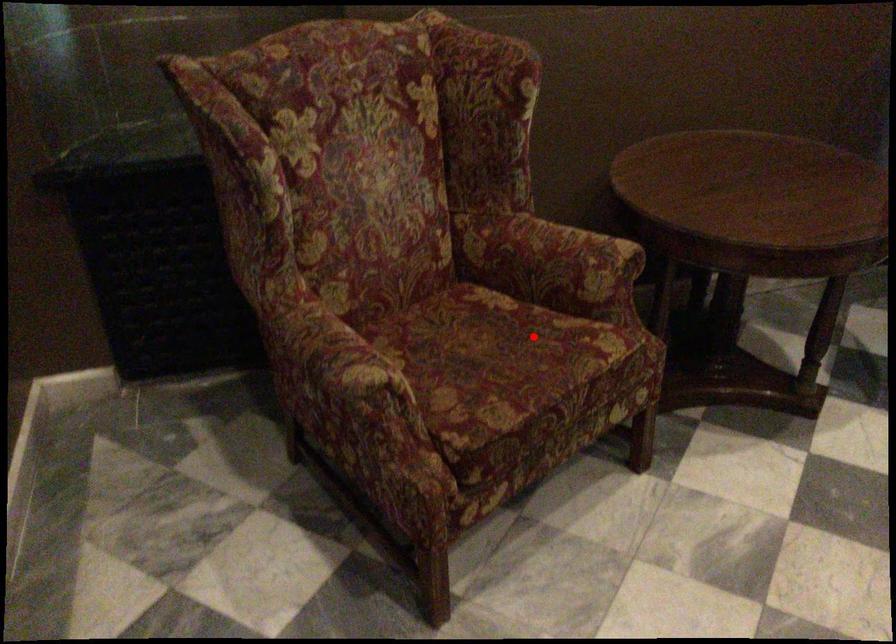
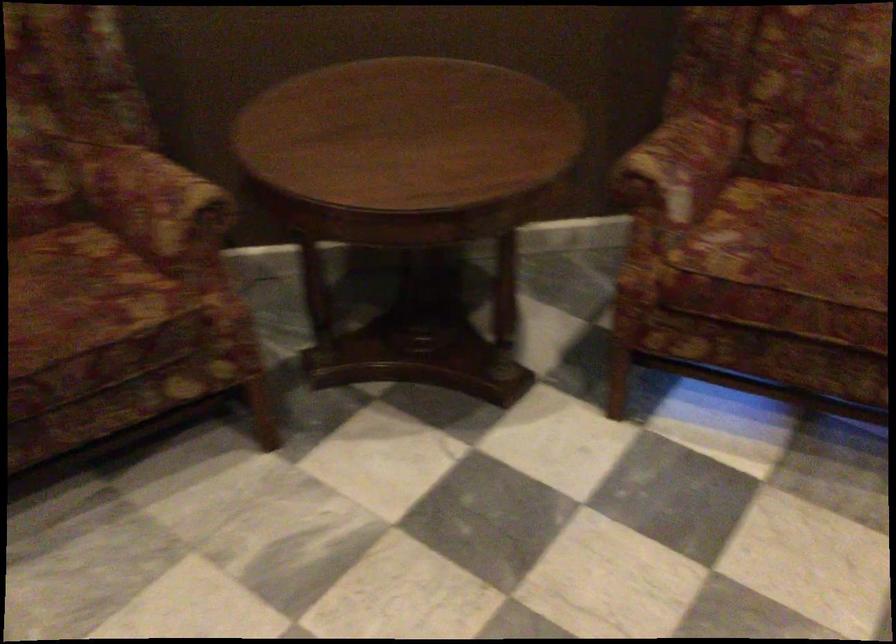
Question: I am providing you with two images of the same scene from different viewpoints. A red point is shown in image1. For the corresponding object point in image2, is it positioned nearer or farther from the camera?

Choices:
 (A) Nearer
 (B) Farther

Answer: (A)